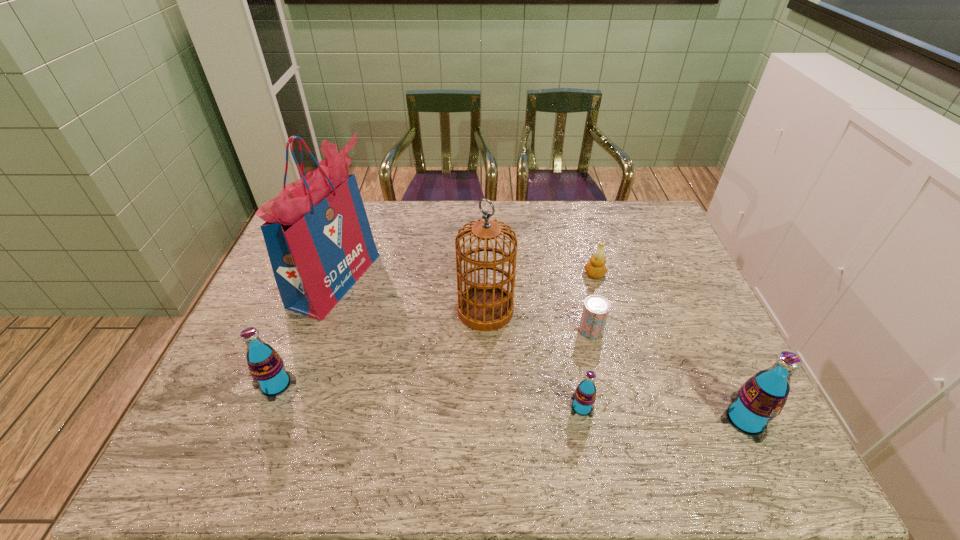
Locate an element on the screen. Image resolution: width=960 pixels, height=540 pixels. free space located on the right of the second tallest soda is located at coordinates (415, 384).

You are a GUI agent. You are given a task and a screenshot of the screen. Output one action in this format:
    pyautogui.click(x=<x>, y=<y>)
    Task: Click on the vacant area situated 0.230m on the right of the second soda from right to left
    The height and width of the screenshot is (540, 960).
    Given the screenshot: What is the action you would take?
    pyautogui.click(x=692, y=407)

The image size is (960, 540). In order to click on vacant space located 0.290m on the left of the rightmost object in this screenshot , I will do `click(593, 420)`.

Where is `free location located 0.050m on the front-facing side of the grocery bag`? free location located 0.050m on the front-facing side of the grocery bag is located at coordinates (390, 280).

The width and height of the screenshot is (960, 540). I want to click on free space located 0.060m on the front of the candle_holder, so click(601, 295).

At what (x,y) coordinates should I click in order to perform the action: click on free region located 0.320m on the back of the sixth shortest object. Please return your answer as a coordinate pair (x, y). This screenshot has width=960, height=540. Looking at the image, I should click on (485, 226).

Identify the location of vacant point located on the left of the shortest object. The image size is (960, 540). (491, 330).

What are the coordinates of `soda at the left edge` in the screenshot? It's located at (266, 367).

Locate an element on the screen. This screenshot has width=960, height=540. grocery bag that is at the left edge is located at coordinates (317, 234).

Image resolution: width=960 pixels, height=540 pixels. I want to click on object that is positioned at the right edge, so click(x=761, y=398).